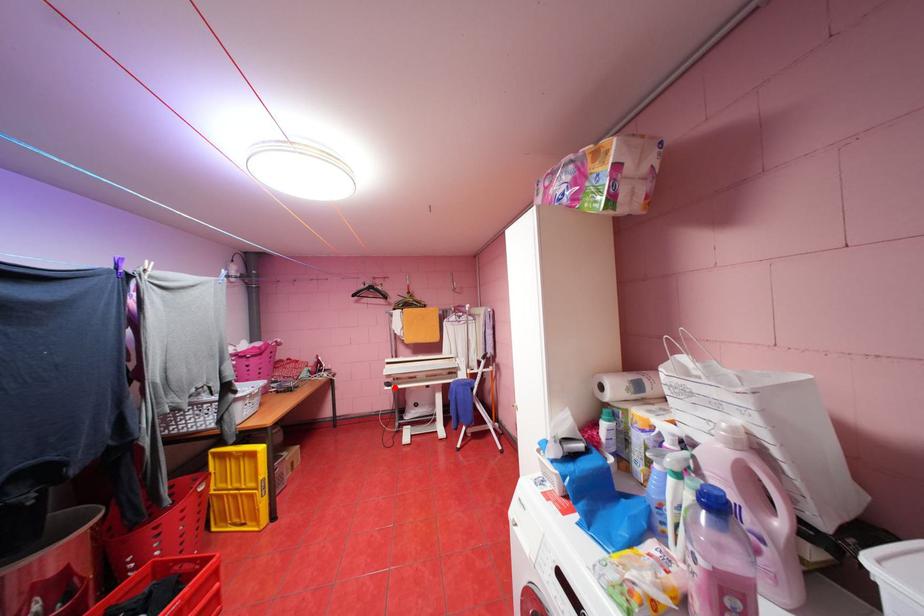
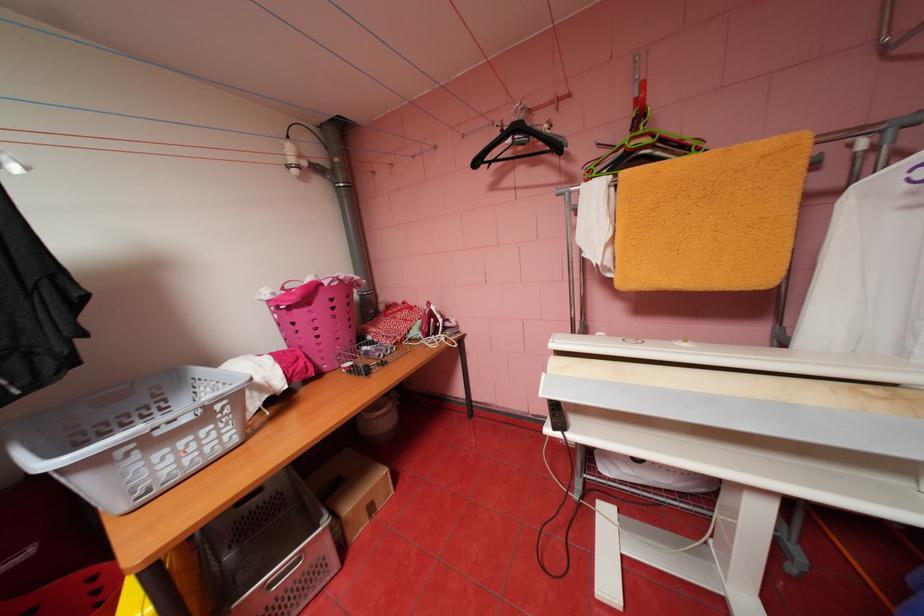
Question: I am providing you with two images of the same scene from different viewpoints. A red point is marked on the first image. At the location where the point appears in image 1, is it still visible in image 2?

Choices:
 (A) Yes
 (B) No

Answer: (B)